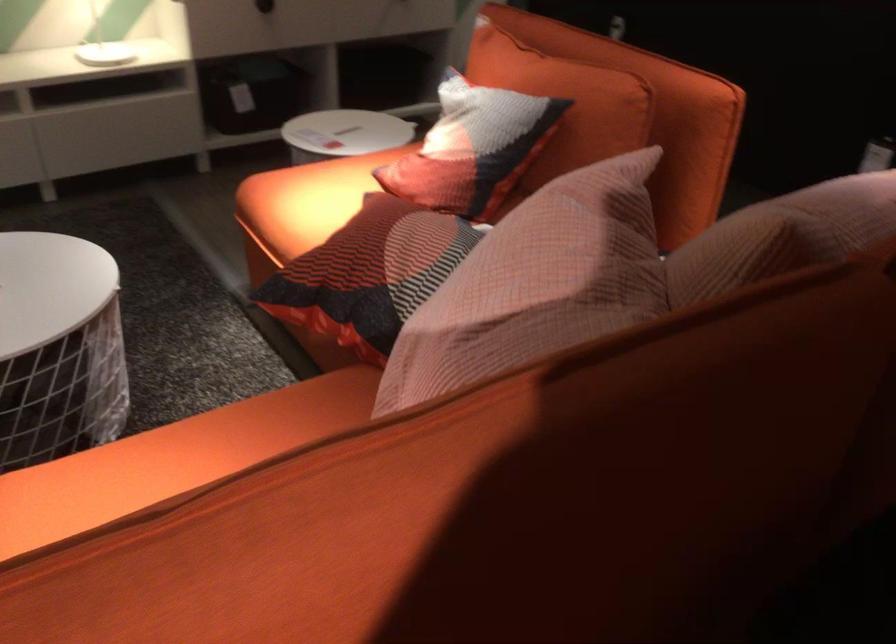
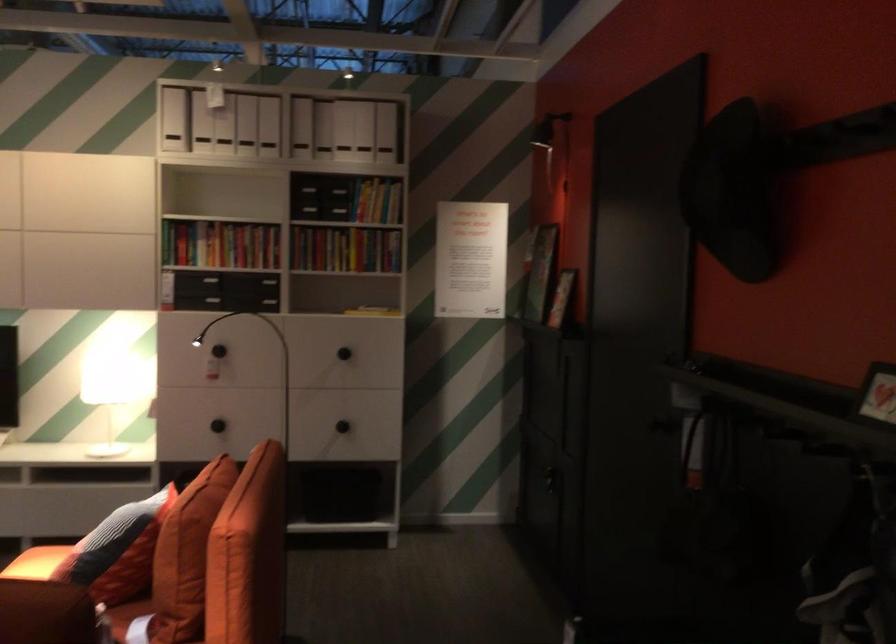
In the second image, find the point that corresponds to pixel 342 181 in the first image.

(36, 563)